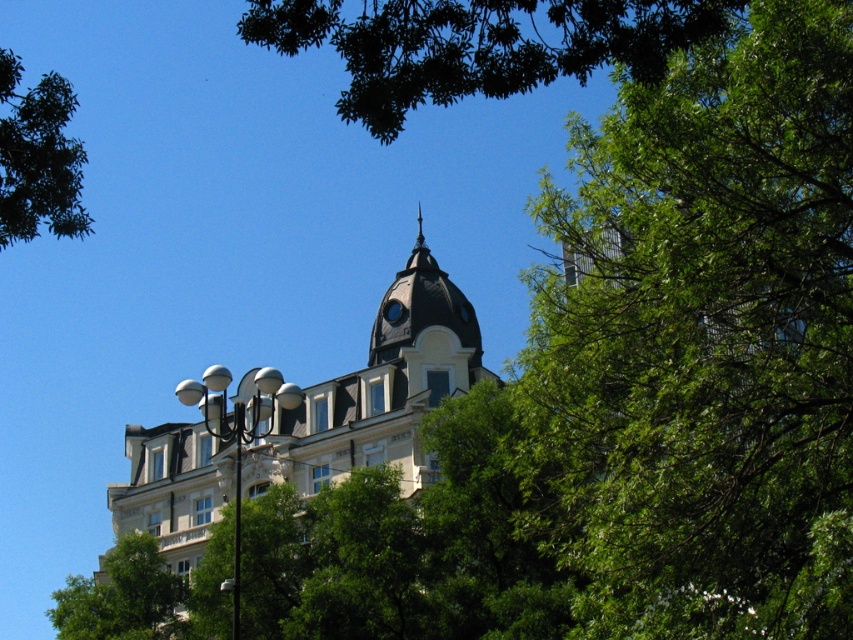
Locate an element on the screen. The height and width of the screenshot is (640, 853). white stone building at center is located at coordinates (375, 392).

Which is in front, point (436, 396) or point (94, 611)?

Point (436, 396) is more forward.

Identify the location of white stone building at center. (375, 392).

Which of these two, green leafy tree at upper right or green leafy tree at upper left, stands taller?

With more height is green leafy tree at upper right.

Does green leafy tree at upper right have a lesser height compared to green leafy tree at upper left?

No, green leafy tree at upper right is not shorter than green leafy tree at upper left.

Who is more forward, (785, 580) or (36, 93)?

Positioned in front is point (36, 93).

Locate an element on the screen. This screenshot has width=853, height=640. green leafy tree at upper right is located at coordinates (701, 344).

Is green leafy tree at upper center positioned behind white glossy lamp post at center-left?

No, it is not.

Does green leafy tree at upper center have a lesser width compared to white glossy lamp post at center-left?

In fact, green leafy tree at upper center might be wider than white glossy lamp post at center-left.

Is point (614, 61) behind point (263, 378)?

That is False.

Locate an element on the screen. green leafy tree at upper center is located at coordinates (479, 44).